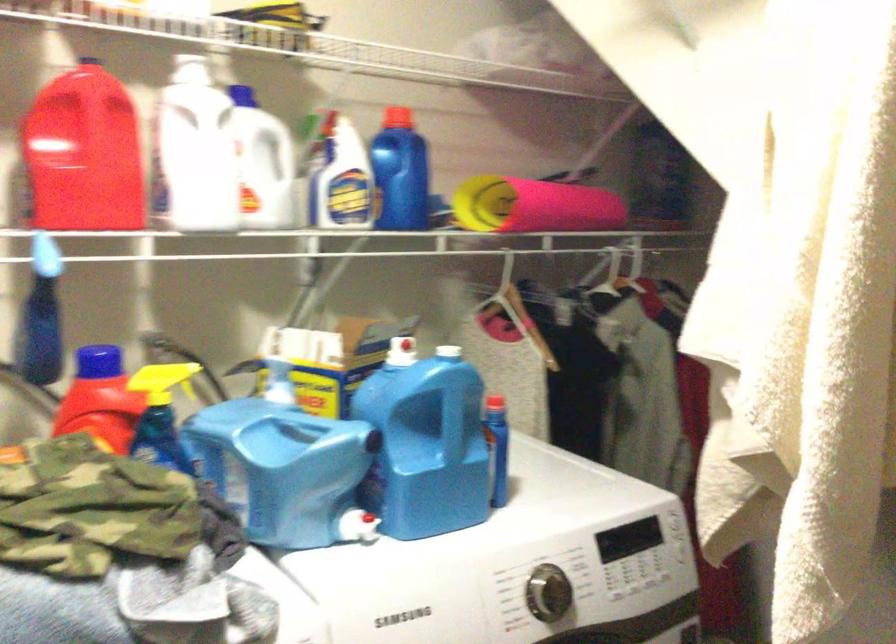
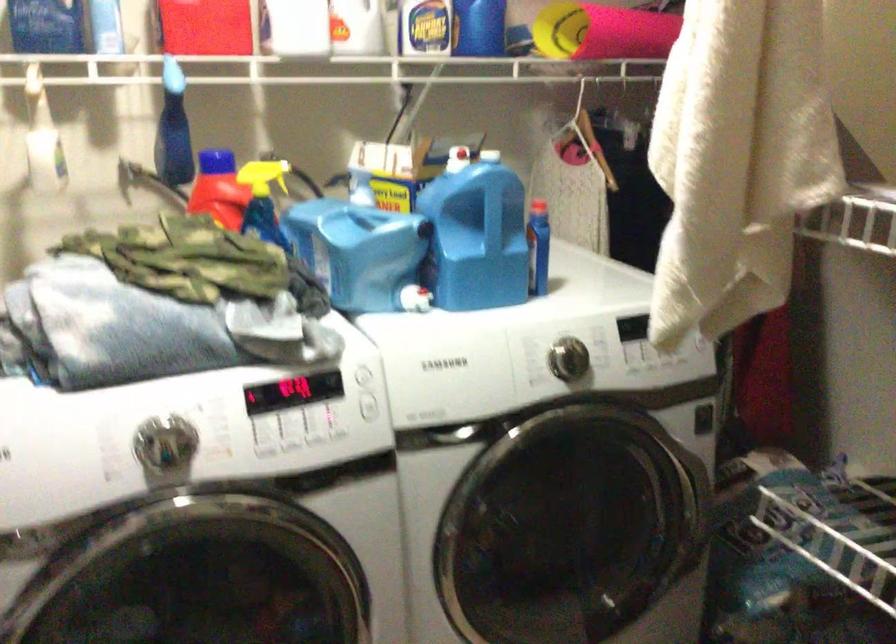
Find the pixel in the second image that matches pixel 357 527 in the first image.

(415, 298)